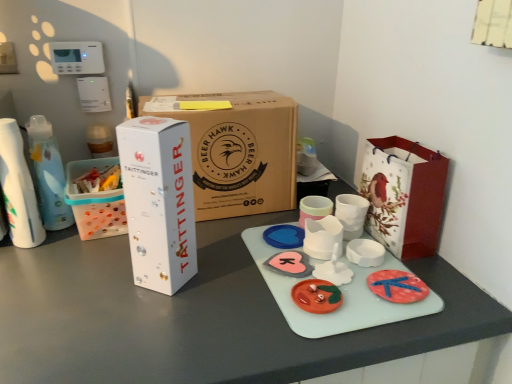
The width and height of the screenshot is (512, 384). In order to click on free spot to the left of blue rubber heart at center, the first toy from the back in this screenshot , I will do `click(227, 240)`.